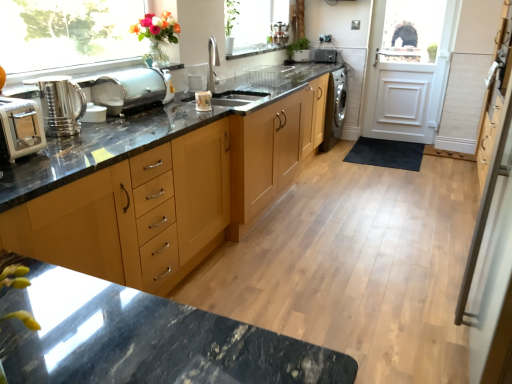
Describe the element at coordinates (203, 101) in the screenshot. I see `glossy ceramic mug at upper center, the first appliance ordered from the bottom` at that location.

Where is `glossy ceramic mug at upper center, marked as the second appliance in a front-to-back arrangement`? The image size is (512, 384). glossy ceramic mug at upper center, marked as the second appliance in a front-to-back arrangement is located at coordinates (203, 101).

At what (x,y) coordinates should I click in order to perform the action: click on shiny metallic kettle at left. Please return your answer as a coordinate pair (x, y). Image resolution: width=512 pixels, height=384 pixels. Looking at the image, I should click on (61, 104).

Find the location of `white wooden door at upper right`. white wooden door at upper right is located at coordinates (409, 71).

What do you see at coordinates (492, 231) in the screenshot? The image size is (512, 384). I see `silver metallic screen door at right` at bounding box center [492, 231].

In order to face satin silver bread bin at center, the second appliance from the bottom, should I rotate leftwards or rightwards?

Rotate your view left by about 15.885°.

You are a GUI agent. You are given a task and a screenshot of the screen. Output one action in this format:
    pyautogui.click(x=<x>, y=<y>)
    Task: Click on the glossy ceramic mug at upper center, the second appliance in the left-to-right sequence
    
    Given the screenshot: What is the action you would take?
    pyautogui.click(x=203, y=101)

Looking at this image, from a real-world perspective, is satin silver bread bin at center, acting as the 3th appliance starting from the right, positioned over glossy ceramic mug at upper center, marked as the second appliance in a front-to-back arrangement, based on gravity?

Yes.

Does satin silver bread bin at center, which ranks as the 3th appliance in back-to-front order, turn towards glossy ceramic mug at upper center, which is counted as the 2th appliance, starting from the back?

Yes.

Considering the relative sizes of satin silver bread bin at center, the second appliance from the bottom, and glossy ceramic mug at upper center, which is counted as the third appliance, starting from the top, in the image provided, is satin silver bread bin at center, the second appliance from the bottom, thinner than glossy ceramic mug at upper center, which is counted as the third appliance, starting from the top,?

In fact, satin silver bread bin at center, the second appliance from the bottom, might be wider than glossy ceramic mug at upper center, which is counted as the third appliance, starting from the top.

Based on the photo, could you tell me if shiny metallic kettle at left is turned towards white matte vase at upper center?

No, shiny metallic kettle at left does not turn towards white matte vase at upper center.

From the image's perspective, which one is positioned lower, shiny metallic kettle at left or white matte vase at upper center?

shiny metallic kettle at left, from the image's perspective.

Is shiny metallic kettle at left not inside white matte vase at upper center?

That's correct, shiny metallic kettle at left is outside of white matte vase at upper center.

In order to click on kitchen appliance located in front of the white matte vase at upper center in this screenshot , I will do `click(61, 104)`.

Is satin silver bread bin at center, the first appliance when ordered from left to right, positioned with its back to shiny metallic kettle at left?

No, satin silver bread bin at center, the first appliance when ordered from left to right, is not facing away from shiny metallic kettle at left.

Who is bigger, satin silver bread bin at center, acting as the 3th appliance starting from the right, or shiny metallic kettle at left?

Bigger between the two is satin silver bread bin at center, acting as the 3th appliance starting from the right.

Identify the location of kitchen appliance located above the satin silver bread bin at center, the second appliance in the top-to-bottom sequence (from a real-world perspective). The width and height of the screenshot is (512, 384). (61, 104).

From the image's perspective, is light wood cabinet at center on top of white matte vase at upper center?

Actually, light wood cabinet at center appears below white matte vase at upper center in the image.

Is light wood cabinet at center far away from white matte vase at upper center?

Indeed, light wood cabinet at center is not near white matte vase at upper center.

Measure the distance between light wood cabinet at center and white matte vase at upper center.

light wood cabinet at center is 1.60 meters away from white matte vase at upper center.

Considering the positions of objects light wood cabinet at center and white matte vase at upper center in the image provided, who is more to the right, light wood cabinet at center or white matte vase at upper center?

light wood cabinet at center.

Based on the photo, relative to silver metallic screen door at right, is clear glass window at upper left in front or behind?

clear glass window at upper left is positioned farther from the viewer than silver metallic screen door at right.

Who is shorter, clear glass window at upper left or silver metallic screen door at right?

clear glass window at upper left is shorter.

Is clear glass window at upper left inside the boundaries of silver metallic screen door at right, or outside?

clear glass window at upper left is outside silver metallic screen door at right.

What's the angular difference between clear glass window at upper left and silver metallic screen door at right's facing directions?

179 degrees separate the facing orientations of clear glass window at upper left and silver metallic screen door at right.

Does point (25, 56) come behind point (36, 150)?

That is True.

Is clear glass window at upper left thinner than white plastic toaster at left?

Yes.

Does clear glass window at upper left have a lesser height compared to white plastic toaster at left?

No.

In the scene shown: From a real-world perspective, is clear glass window at upper left on white plastic toaster at left?

Correct, in the physical world, clear glass window at upper left is higher than white plastic toaster at left.

From the image's perspective, which is below, white plastic toaster at left or light wood cabinet at center?

From the image's view, white plastic toaster at left is below.

Based on the photo, would you say white plastic toaster at left is a long distance from light wood cabinet at center?

Yes, white plastic toaster at left and light wood cabinet at center are located far from each other.

Can you confirm if white plastic toaster at left is bigger than light wood cabinet at center?

Incorrect, white plastic toaster at left is not larger than light wood cabinet at center.

This screenshot has height=384, width=512. I want to click on the 1st appliance behind the satin silver bread bin at center, acting as the 3th appliance starting from the right, starting your count from the anchor, so click(203, 101).

What are the coordinates of `window screen that appears above the shiny metallic kettle at left (from the image's perspective)` in the screenshot? It's located at (256, 27).

Based on their spatial positions, is glossy ceramic mug at upper center, marked as the second appliance in a front-to-back arrangement, or light wood cabinet at center further from white matte vase at upper center?

Among the two, glossy ceramic mug at upper center, marked as the second appliance in a front-to-back arrangement, is located further to white matte vase at upper center.

Considering their positions, is satin silver bread bin at center, the second appliance in the top-to-bottom sequence, positioned further to glossy ceramic mug at upper center, the second appliance in the left-to-right sequence, than white wooden door at upper right?

white wooden door at upper right.

When comparing their distances from white wooden door at upper right, does clear glass window at upper left or glossy ceramic mug at upper center, the second appliance in the left-to-right sequence, seem further?

clear glass window at upper left.

In the scene shown: Estimate the real-world distances between objects in this image. Which object is closer to clear glass window at upper left, white matte vase at upper center or satin black camera at center, which is the third appliance from front to back?

white matte vase at upper center lies closer to clear glass window at upper left than the other object.

Estimate the real-world distances between objects in this image. Which object is closer to white wooden door at upper right, white plastic toaster at left or light wood cabinet at center?

light wood cabinet at center.

Which object lies nearer to the anchor point white plastic toaster at left, satin black camera at center, the 1th appliance when ordered from right to left, or glossy ceramic mug at upper center, which ranks as the 2th appliance in right-to-left order?

glossy ceramic mug at upper center, which ranks as the 2th appliance in right-to-left order, is closer to white plastic toaster at left.

Based on their spatial positions, is brushed metal sink at center or white plastic toaster at left further from white matte vase at upper center?

white plastic toaster at left is further to white matte vase at upper center.

Based on their spatial positions, is glossy ceramic mug at upper center, the second appliance in the left-to-right sequence, or white matte vase at upper center further from shiny metallic kettle at left?

white matte vase at upper center is positioned further to the anchor shiny metallic kettle at left.

You are a GUI agent. You are given a task and a screenshot of the screen. Output one action in this format:
    pyautogui.click(x=<x>, y=<y>)
    Task: Click on the cabinetry located between glossy ceramic mug at upper center, which is counted as the 2th appliance, starting from the back, and satin black camera at center, which is counted as the 1th appliance, starting from the top, in the depth direction
    This screenshot has width=512, height=384.
    Given the screenshot: What is the action you would take?
    pyautogui.click(x=272, y=152)

You are a GUI agent. You are given a task and a screenshot of the screen. Output one action in this format:
    pyautogui.click(x=<x>, y=<y>)
    Task: Click on the sink between silver metallic screen door at right and white wooden door at upper right along the z-axis
    The width and height of the screenshot is (512, 384).
    Given the screenshot: What is the action you would take?
    pyautogui.click(x=216, y=74)

I want to click on appliance between satin silver bread bin at center, the first appliance when ordered from left to right, and light wood cabinet at center, along the z-axis, so click(203, 101).

This screenshot has height=384, width=512. I want to click on sink located between clear glass window at upper left and silver metallic screen door at right in the left-right direction, so click(216, 74).